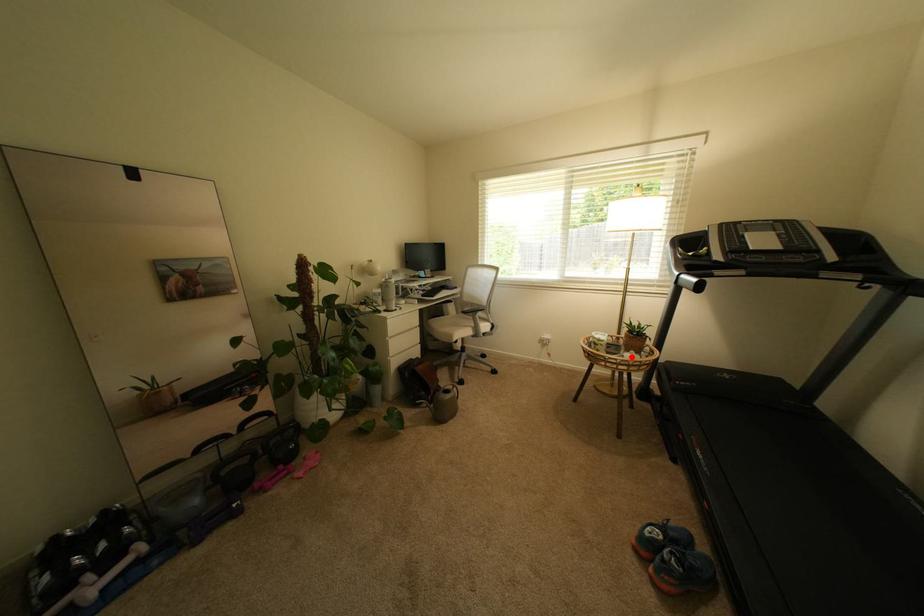
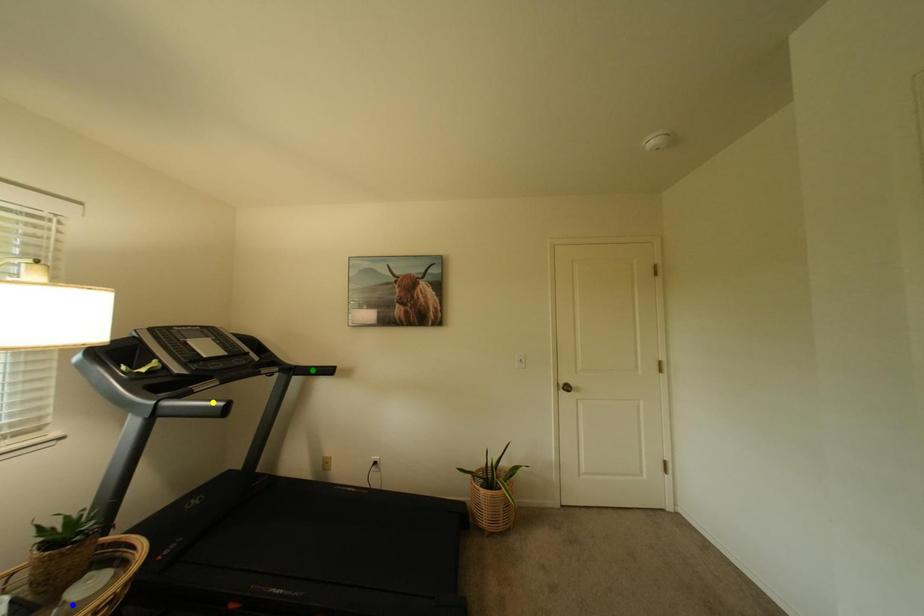
Question: I am providing you with two images of the same scene from different viewpoints. A red point is marked on the first image. You are given multiple points on the second image. Which mark in image 2 goes with the point in image 1?

Choices:
 (A) green point
 (B) yellow point
 (C) blue point

Answer: (C)